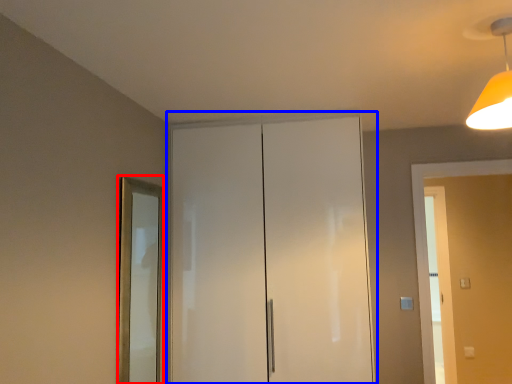
Question: Which point is further to the camera, mirror (highlighted by a red box) or dresser (highlighted by a blue box)?

Choices:
 (A) mirror
 (B) dresser

Answer: (B)